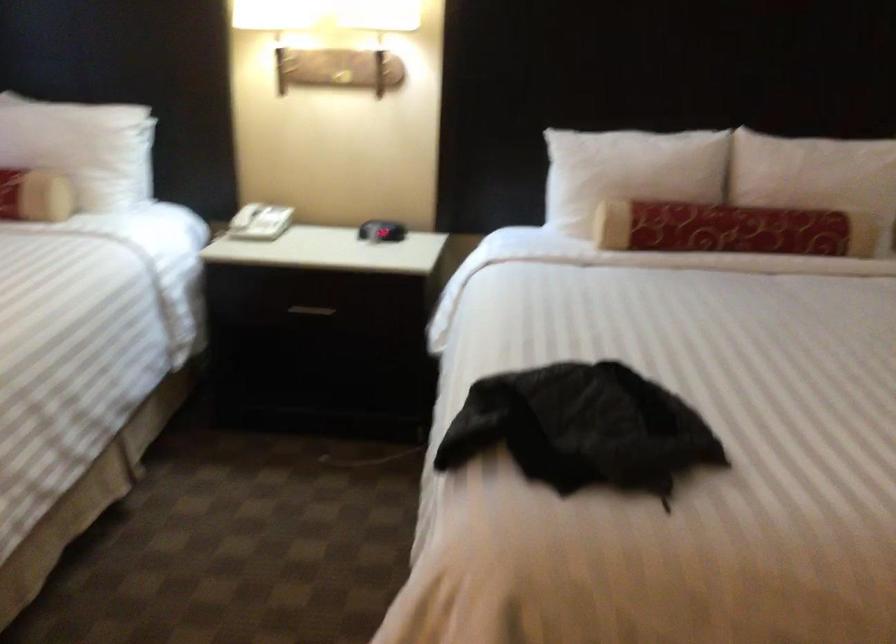
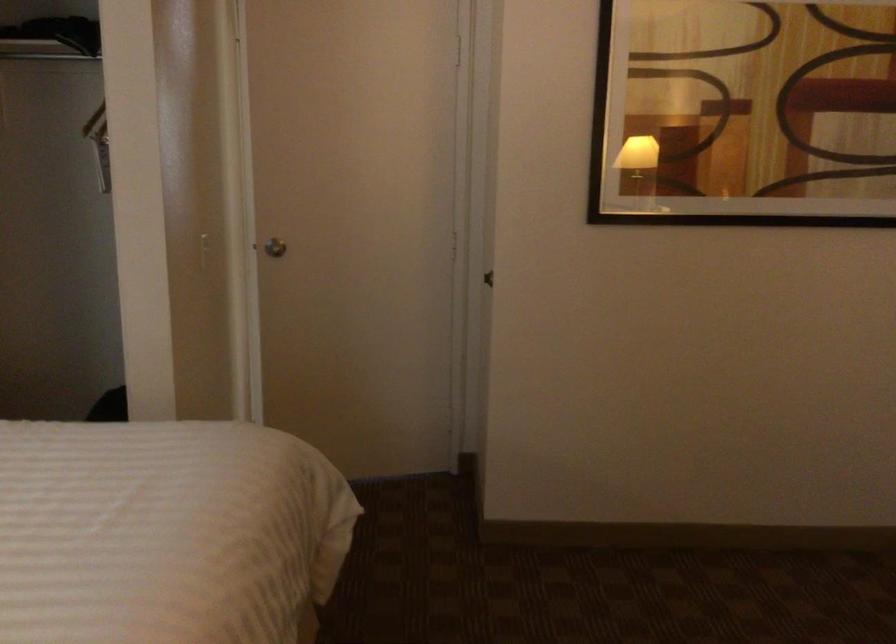
Question: How did the camera likely rotate?

Choices:
 (A) Left
 (B) Right
 (C) Up
 (D) Down

Answer: (B)